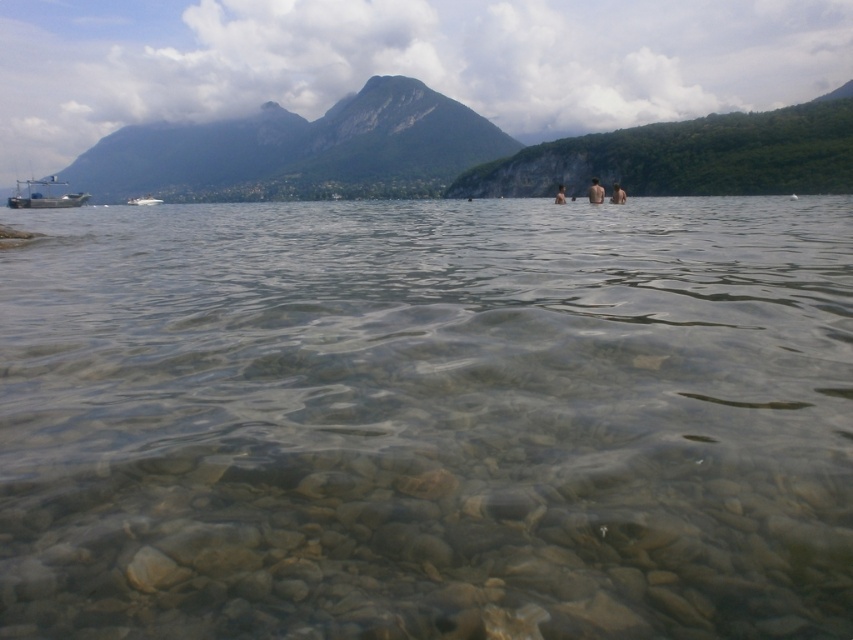
Question: Which object appears closest to the camera in this image?

Choices:
 (A) green rock mountain at upper center
 (B) skinny person at center

Answer: (B)

Question: Considering the relative positions of white glossy boat at left and skinny person at center in the image provided, where is white glossy boat at left located with respect to skinny person at center?

Choices:
 (A) below
 (B) above

Answer: (B)

Question: Is clear rock bottom at center below skinny man at center?

Choices:
 (A) yes
 (B) no

Answer: (A)

Question: Does brown skin couple at center lie in front of white glossy boat at left?

Choices:
 (A) yes
 (B) no

Answer: (A)

Question: Among these objects, which one is nearest to the camera?

Choices:
 (A) skinny man at center
 (B) green rock mountain at upper center
 (C) white glossy boat at left

Answer: (A)

Question: Which of the following is the farthest from the observer?

Choices:
 (A) (132, 204)
 (B) (277, 189)
 (C) (599, 189)

Answer: (B)